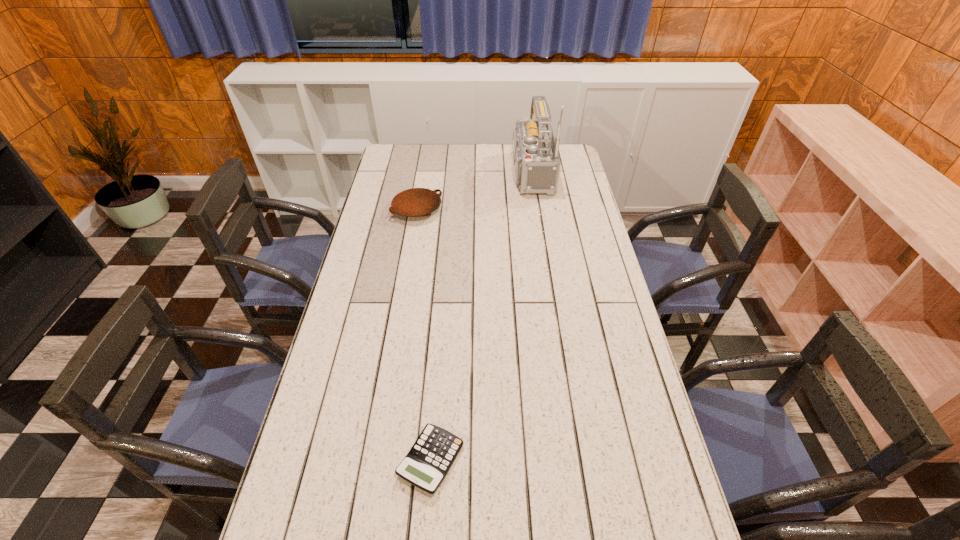
Find the location of a particular element. The image size is (960, 540). object that is at the far edge is located at coordinates (537, 163).

At what (x,y) coordinates should I click in order to perform the action: click on object that is at the left edge. Please return your answer as a coordinate pair (x, y). Looking at the image, I should click on (415, 202).

The width and height of the screenshot is (960, 540). What are the coordinates of `object that is at the right edge` in the screenshot? It's located at (537, 163).

Find the location of `object positioned at the far right corner`. object positioned at the far right corner is located at coordinates (537, 163).

Where is `blank space at the far edge of the desktop`? This screenshot has height=540, width=960. blank space at the far edge of the desktop is located at coordinates (425, 144).

Locate an element on the screen. free space at the left edge of the desktop is located at coordinates (311, 508).

This screenshot has width=960, height=540. I want to click on free region at the right edge of the desktop, so click(606, 330).

The height and width of the screenshot is (540, 960). I want to click on free spot between the plate and the radio receiver, so click(x=471, y=191).

What are the coordinates of `unoccupied position between the second tallest object and the nearest object` in the screenshot? It's located at (424, 335).

The height and width of the screenshot is (540, 960). I want to click on free space that is in between the tallest object and the plate, so click(x=471, y=191).